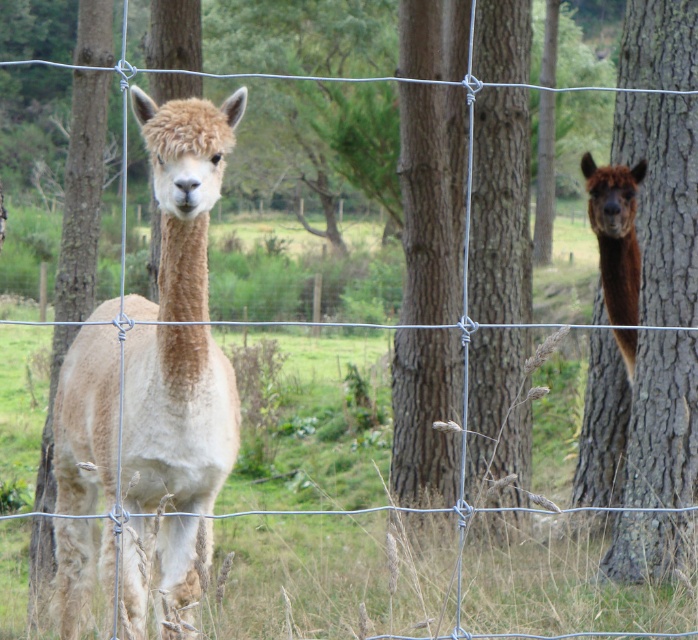
Can you confirm if brown rough bark tree at right is shorter than brown woolly alpaca at right?

No.

Image resolution: width=698 pixels, height=640 pixels. Identify the location of brown rough bark tree at right. (644, 419).

Is point (595, 364) positioned before point (625, 304)?

That is False.

Find the location of a particular element. This screenshot has width=698, height=640. brown rough bark tree at right is located at coordinates (644, 419).

Can you confirm if light brown woolen alpaca at center is positioned below brown rough bark tree at right?

Yes.

You are a GUI agent. You are given a task and a screenshot of the screen. Output one action in this format:
    pyautogui.click(x=<x>, y=<y>)
    Task: Click on the light brown woolen alpaca at center
    
    Given the screenshot: What is the action you would take?
    pyautogui.click(x=177, y=419)

Which is behind, point (155, 360) or point (688, 531)?

Positioned behind is point (688, 531).

Where is `light brown woolen alpaca at center`? light brown woolen alpaca at center is located at coordinates (177, 419).

Does light brown woolen alpaca at center have a lesser height compared to brown woolly alpaca at right?

No, light brown woolen alpaca at center is not shorter than brown woolly alpaca at right.

Can you confirm if light brown woolen alpaca at center is wider than brown woolly alpaca at right?

Yes.

Does point (193, 257) come farther from viewer compared to point (621, 333)?

No, (193, 257) is closer to viewer.

Locate an element on the screen. light brown woolen alpaca at center is located at coordinates (177, 419).